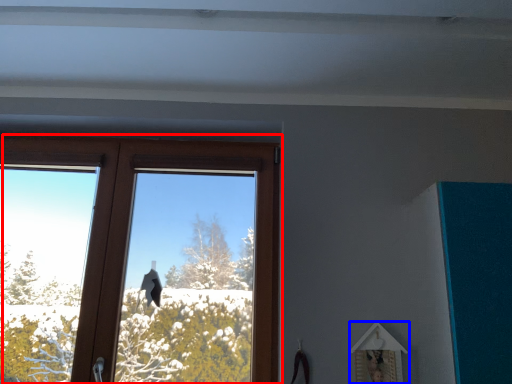
Question: Which of the following is the closest to the observer, window (highlighted by a red box) or picture frame (highlighted by a blue box)?

Choices:
 (A) window
 (B) picture frame

Answer: (B)